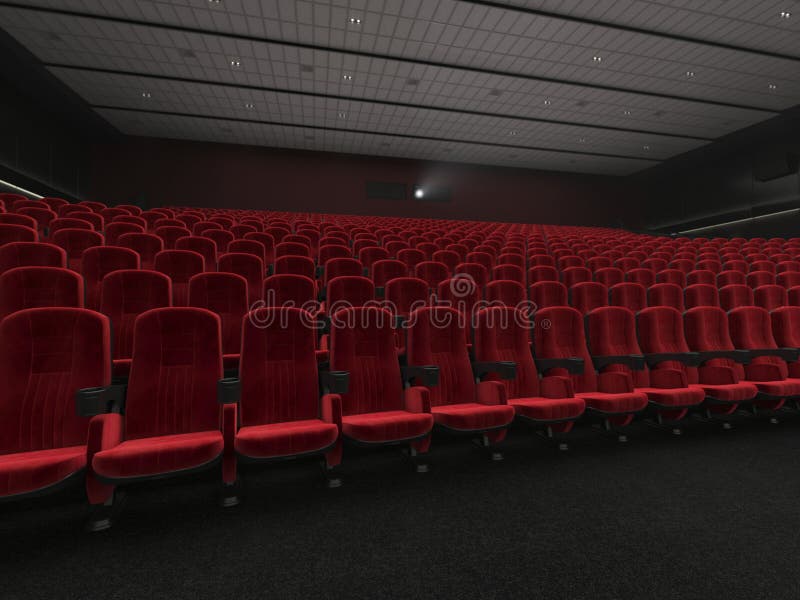
At what (x,y) coordinates should I click in order to perform the action: click on chair legs. Please return your answer as a coordinate pair (x, y). The height and width of the screenshot is (600, 800). Looking at the image, I should click on (112, 518), (233, 494), (338, 481), (425, 465), (505, 460), (560, 447), (626, 441), (681, 431), (730, 425), (774, 419).